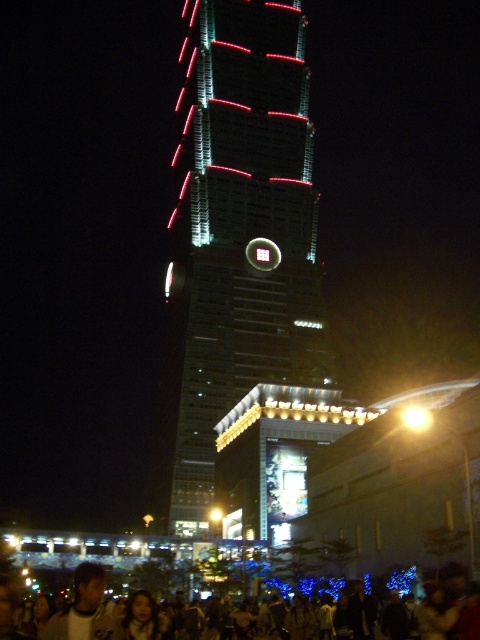
Does point (291, 372) come behind point (88, 621)?

Yes.

Who is taller, glassy reflective skyscraper at center or light brown hair at lower left?

Standing taller between the two is glassy reflective skyscraper at center.

Where is `glassy reflective skyscraper at center`? glassy reflective skyscraper at center is located at coordinates (237, 237).

Is dark clothing crowd at lower center to the left of light brown hair at lower left from the viewer's perspective?

In fact, dark clothing crowd at lower center is to the right of light brown hair at lower left.

Find the location of a particular element. This screenshot has height=640, width=480. dark clothing crowd at lower center is located at coordinates (13, 611).

Is point (464, 625) positioned before point (103, 621)?

No.

Where is `dark clothing crowd at lower center`? The height and width of the screenshot is (640, 480). dark clothing crowd at lower center is located at coordinates (13, 611).

Who is more forward, [48,634] or [147,628]?

Point [48,634] is in front.

Does light brown hair at lower left come in front of smooth skin face at lower center?

Yes.

Locate an element on the screen. The height and width of the screenshot is (640, 480). light brown hair at lower left is located at coordinates (83, 609).